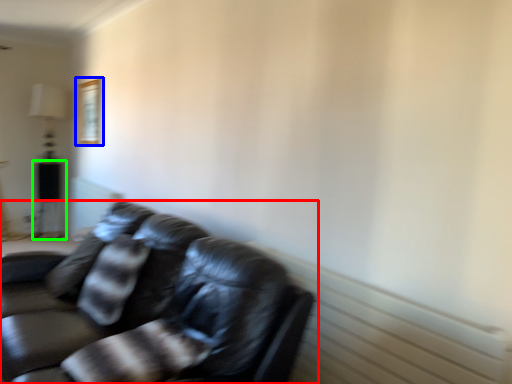
Question: Which object is positioned closest to studio couch (highlighted by a red box)? Select from picture frame (highlighted by a blue box) and table (highlighted by a green box).

Choices:
 (A) picture frame
 (B) table

Answer: (A)